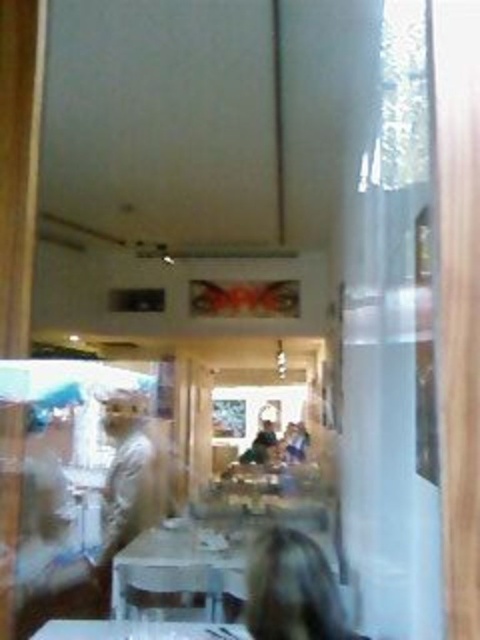
Question: Is white glossy table at center closer to camera compared to white glossy table at lower center?

Choices:
 (A) no
 (B) yes

Answer: (A)

Question: Which point is closer to the camera taking this photo?

Choices:
 (A) (208, 579)
 (B) (197, 630)

Answer: (B)

Question: Can you confirm if white glossy table at center is thinner than white glossy table at lower center?

Choices:
 (A) no
 (B) yes

Answer: (B)

Question: Observing the image, what is the correct spatial positioning of white glossy table at center in reference to white glossy table at lower center?

Choices:
 (A) below
 (B) above

Answer: (A)

Question: Which point appears farthest from the camera in this image?

Choices:
 (A) (47, 637)
 (B) (192, 563)

Answer: (B)